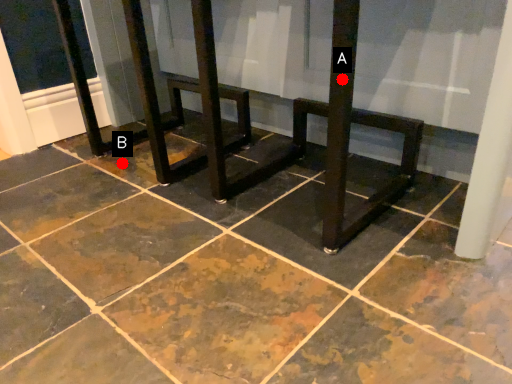
Question: Two points are circled on the image, labeled by A and B beside each circle. Which point is closer to the camera?

Choices:
 (A) A is closer
 (B) B is closer

Answer: (A)